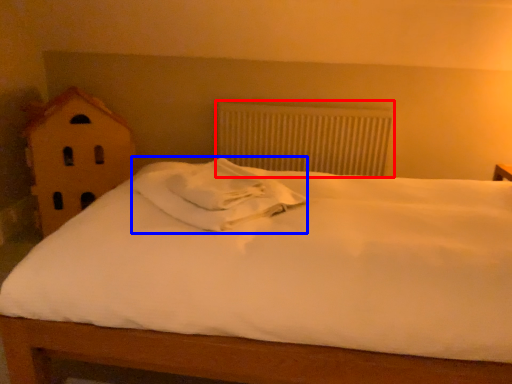
Question: Which of the following is the farthest to the observer, radiator (highlighted by a red box) or pillow (highlighted by a blue box)?

Choices:
 (A) radiator
 (B) pillow

Answer: (A)